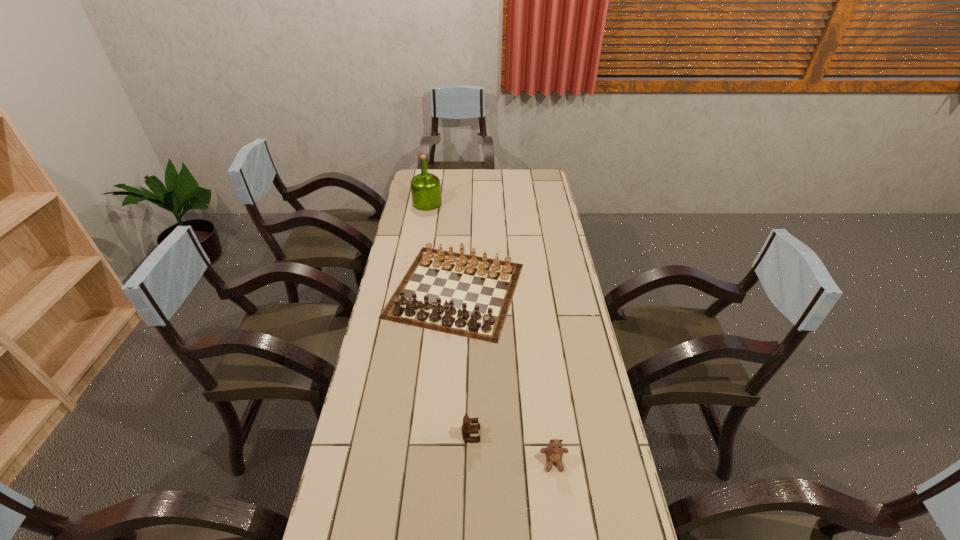
Locate an element on the screen. This screenshot has width=960, height=540. empty location between the chessboard and the nearest object is located at coordinates (505, 376).

Where is `free space between the second farthest object and the farther teddy bear`? The width and height of the screenshot is (960, 540). free space between the second farthest object and the farther teddy bear is located at coordinates (464, 362).

Image resolution: width=960 pixels, height=540 pixels. In order to click on object that stands as the third closest to the third farthest object in this screenshot , I will do `click(425, 187)`.

Locate which object is the closest to the nearer teddy bear. Please provide its 2D coordinates. Your answer should be formatted as a tuple, i.e. [(x, y)], where the tuple contains the x and y coordinates of a point satisfying the conditions above.

[(470, 425)]

Find the location of a particular element. vacant area that satisfies the following two spatial constraints: 1. on the front side of the third nearest object; 2. on the left side of the farthest object is located at coordinates (413, 289).